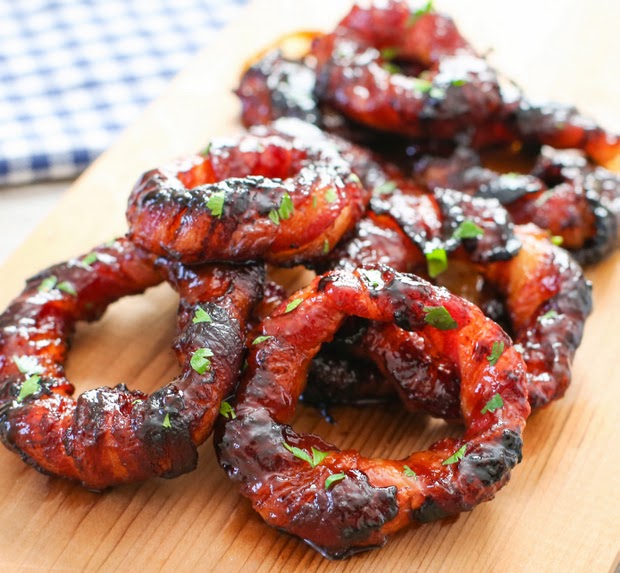
I want to click on light brown wooden cutting board, so point(180,556), point(108,172), point(614,348).